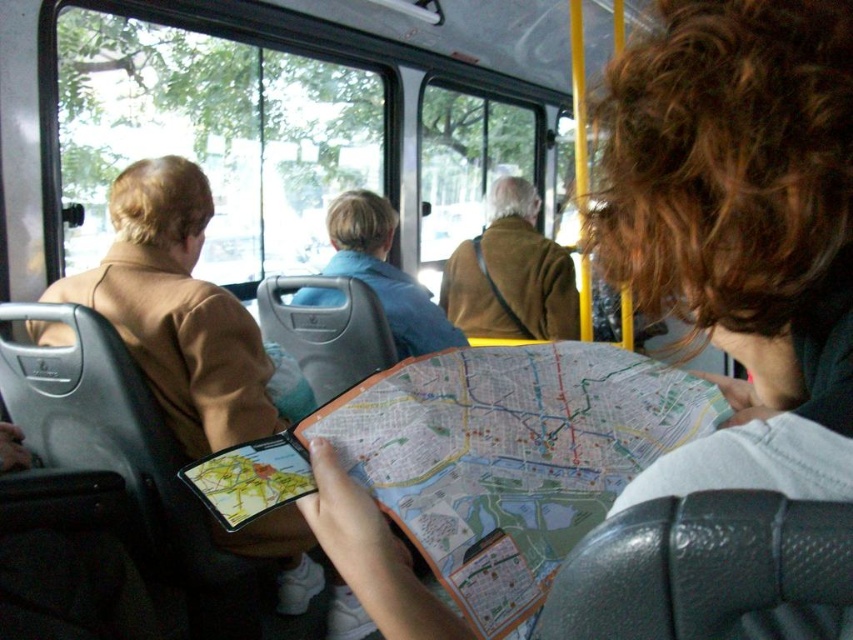
Question: Among these objects, which one is nearest to the camera?

Choices:
 (A) blue cotton shirt at center
 (B) paper map at center
 (C) brown woolen coat at center

Answer: (B)

Question: Is the position of paper map at center more distant than that of blue cotton shirt at center?

Choices:
 (A) no
 (B) yes

Answer: (A)

Question: Which point is closer to the camera?

Choices:
 (A) paper map at center
 (B) blue cotton shirt at center

Answer: (A)

Question: Considering the real-world distances, which object is closest to the paper map at center?

Choices:
 (A) brown woolen coat at center
 (B) blue cotton shirt at center

Answer: (B)

Question: Can you confirm if brown woolen coat at center is bigger than blue cotton shirt at center?

Choices:
 (A) no
 (B) yes

Answer: (A)

Question: Does brown woolen coat at center come in front of blue cotton shirt at center?

Choices:
 (A) no
 (B) yes

Answer: (A)